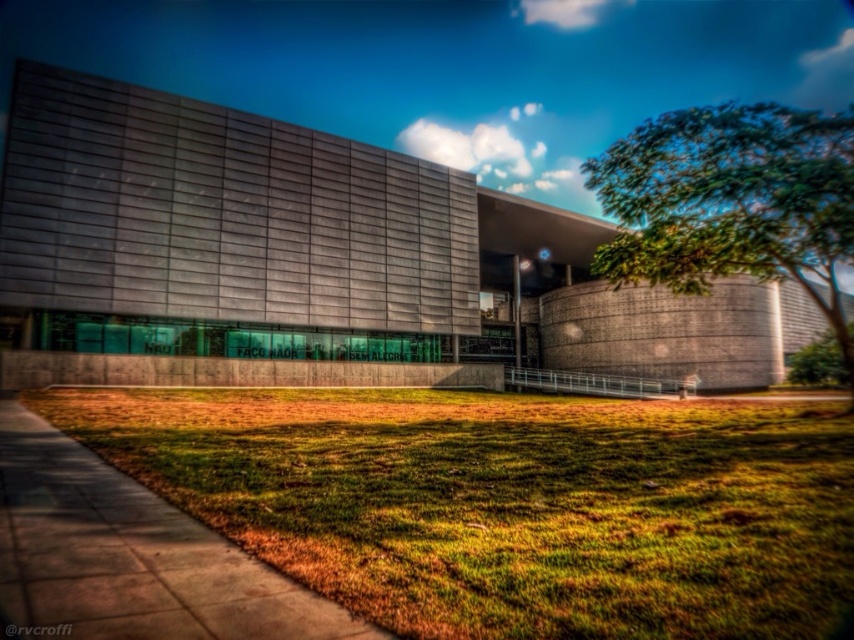
Question: Which point is closer to the camera taking this photo?

Choices:
 (A) (x=646, y=205)
 (B) (x=234, y=540)

Answer: (B)

Question: Which of the following is the closest to the observer?

Choices:
 (A) green leafy tree at right
 (B) green grass at lower center

Answer: (B)

Question: Can you confirm if green grass at lower center is wider than green leafy tree at right?

Choices:
 (A) no
 (B) yes

Answer: (A)

Question: Does green grass at lower center have a lesser width compared to green leafy tree at right?

Choices:
 (A) no
 (B) yes

Answer: (B)

Question: From the image, what is the correct spatial relationship of green grass at lower center in relation to green leafy tree at right?

Choices:
 (A) right
 (B) left

Answer: (B)